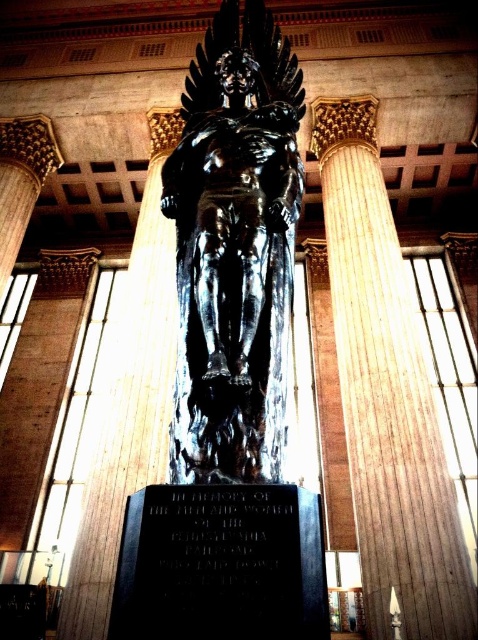
You are standing at the point closest to the statue. There are two points marked in the image, one at coordinate point (x=252, y=70) and the other at coordinate point (x=194, y=624). Which point is closer to you?

Point (x=194, y=624) is closer to you because point (x=252, y=70) is behind it.

You are an interior designer planning to place a new decorative item in the room. The item is 1.2 meters tall. You want to place it near the black polished statue at center and the black stone plaque at center. Considering their sizes, which object should you place the new item closer to, and why?

The black polished statue at center is larger in size than the black stone plaque at center. Therefore, the new item should be placed closer to the black stone plaque at center to maintain visual balance, as the statue is already larger and might dominate the space.